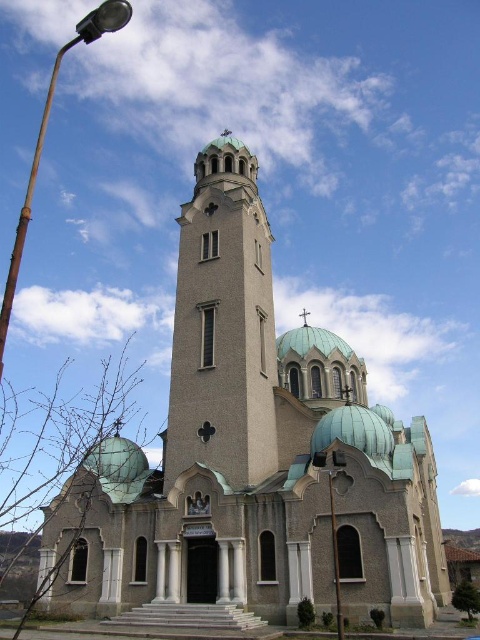
You are standing at the entrance of the church and want to find the rusty metal streetlight at left. According to the coordinates given, in which direction should you look to locate it?

The rusty metal streetlight at left is located at coordinates point (44, 138), so you should look to your left side since it is positioned on the left side of the church.

You are standing in front of the church and want to determine the relative positions of two points marked on its facade. The first point is at coordinate point (121, 8) and the second is at point (336, 580). Which point is closer to you?

Point (121, 8) is closer to the viewer than point (336, 580).